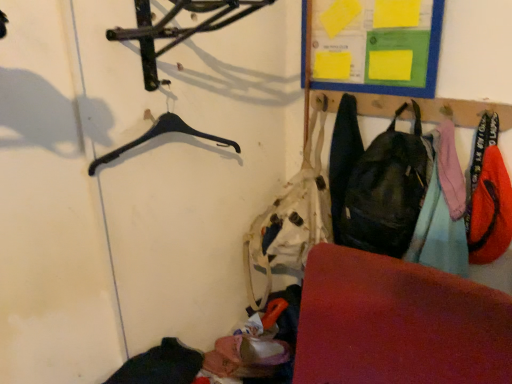
Question: Considering the relative sizes of rubberized red mat at lower right and matte black backpack at center-right, the 3th clothing viewed from the right, in the image provided, is rubberized red mat at lower right taller than matte black backpack at center-right, the 3th clothing viewed from the right,?

Choices:
 (A) no
 (B) yes

Answer: (B)

Question: From the image's perspective, is rubberized red mat at lower right above matte black backpack at center-right, the 3th clothing viewed from the right?

Choices:
 (A) yes
 (B) no

Answer: (B)

Question: Would you consider rubberized red mat at lower right to be distant from matte black backpack at center-right, the 3th clothing viewed from the right?

Choices:
 (A) yes
 (B) no

Answer: (B)

Question: Is rubberized red mat at lower right at the right side of matte black backpack at center-right, which is counted as the 1th clothing, starting from the left?

Choices:
 (A) no
 (B) yes

Answer: (A)

Question: From a real-world perspective, is rubberized red mat at lower right below matte black backpack at center-right, which is counted as the 1th clothing, starting from the left?

Choices:
 (A) no
 (B) yes

Answer: (B)

Question: Considering the relative sizes of rubberized red mat at lower right and matte black backpack at center-right, which is counted as the 1th clothing, starting from the left, in the image provided, is rubberized red mat at lower right thinner than matte black backpack at center-right, which is counted as the 1th clothing, starting from the left,?

Choices:
 (A) no
 (B) yes

Answer: (A)

Question: Does matte black backpack at center-right, the 3th clothing viewed from the right, come behind orange fabric pants at right, the second clothing positioned from the left?

Choices:
 (A) no
 (B) yes

Answer: (B)

Question: From the image's perspective, is matte black backpack at center-right, which is counted as the 1th clothing, starting from the left, under orange fabric pants at right, the second clothing positioned from the left?

Choices:
 (A) no
 (B) yes

Answer: (A)

Question: Is matte black backpack at center-right, which is counted as the 1th clothing, starting from the left, thinner than orange fabric pants at right, the second clothing positioned from the right?

Choices:
 (A) yes
 (B) no

Answer: (B)

Question: Considering the relative positions of matte black backpack at center-right, the 3th clothing viewed from the right, and orange fabric pants at right, the second clothing positioned from the left, in the image provided, is matte black backpack at center-right, the 3th clothing viewed from the right, to the right of orange fabric pants at right, the second clothing positioned from the left, from the viewer's perspective?

Choices:
 (A) yes
 (B) no

Answer: (B)

Question: Is matte black backpack at center-right, the 3th clothing viewed from the right, in contact with orange fabric pants at right, the second clothing positioned from the left?

Choices:
 (A) yes
 (B) no

Answer: (B)

Question: From a real-world perspective, is matte black backpack at center-right, which is counted as the 1th clothing, starting from the left, located beneath orange fabric pants at right, the second clothing positioned from the right?

Choices:
 (A) yes
 (B) no

Answer: (A)

Question: Could you tell me if matte black backpack at center-right, the 3th clothing viewed from the right, is facing matte black backpack at right?

Choices:
 (A) yes
 (B) no

Answer: (B)